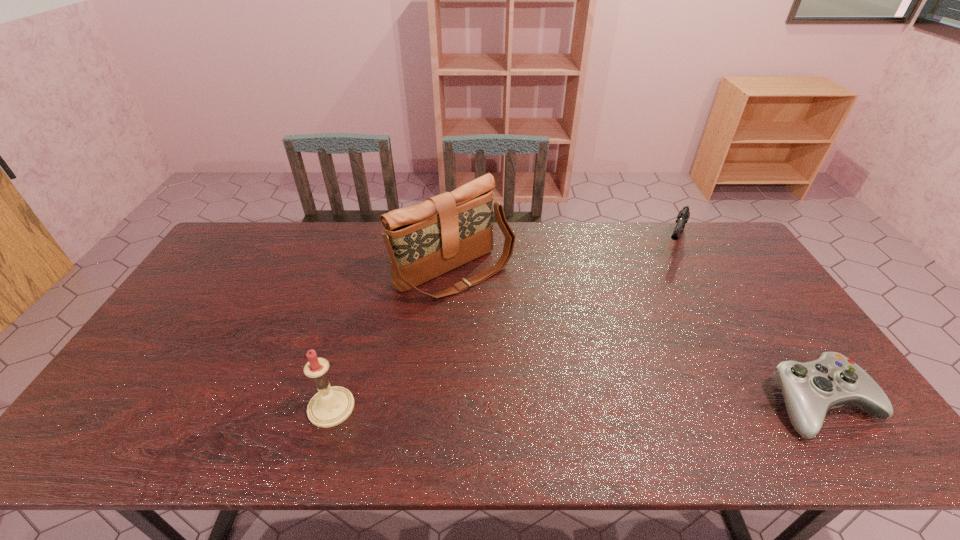
Where is `the third shortest object`? The width and height of the screenshot is (960, 540). the third shortest object is located at coordinates (331, 406).

This screenshot has height=540, width=960. Find the location of `the leftmost object`. the leftmost object is located at coordinates (331, 406).

At what (x,y) coordinates should I click in order to perform the action: click on control. Please return your answer as a coordinate pair (x, y). Image resolution: width=960 pixels, height=540 pixels. Looking at the image, I should click on (810, 389).

The image size is (960, 540). What are the coordinates of `the tallest object` in the screenshot? It's located at (426, 240).

Locate an element on the screen. This screenshot has height=540, width=960. the second object from left to right is located at coordinates (426, 240).

This screenshot has height=540, width=960. Find the location of `gun`. gun is located at coordinates (683, 216).

Find the location of `vacant space located on the left of the candle`. vacant space located on the left of the candle is located at coordinates (272, 408).

I want to click on vacant space located 0.380m on the left of the control, so click(x=616, y=403).

I want to click on blank space located on the front-facing side of the shoulder bag, so (x=582, y=378).

What are the coordinates of `free spot located on the front-facing side of the shoulder bag` in the screenshot? It's located at (517, 321).